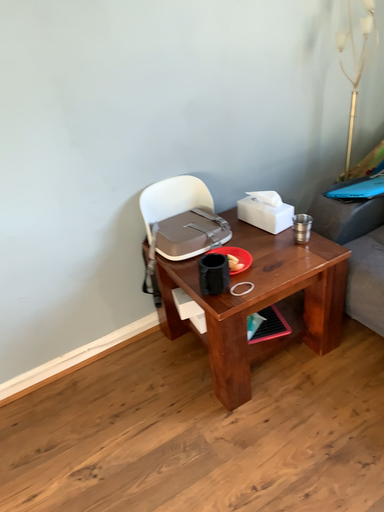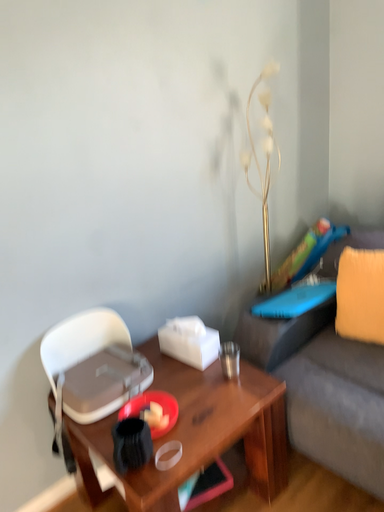
Question: Which way did the camera rotate in the video?

Choices:
 (A) rotated upward
 (B) rotated downward

Answer: (A)